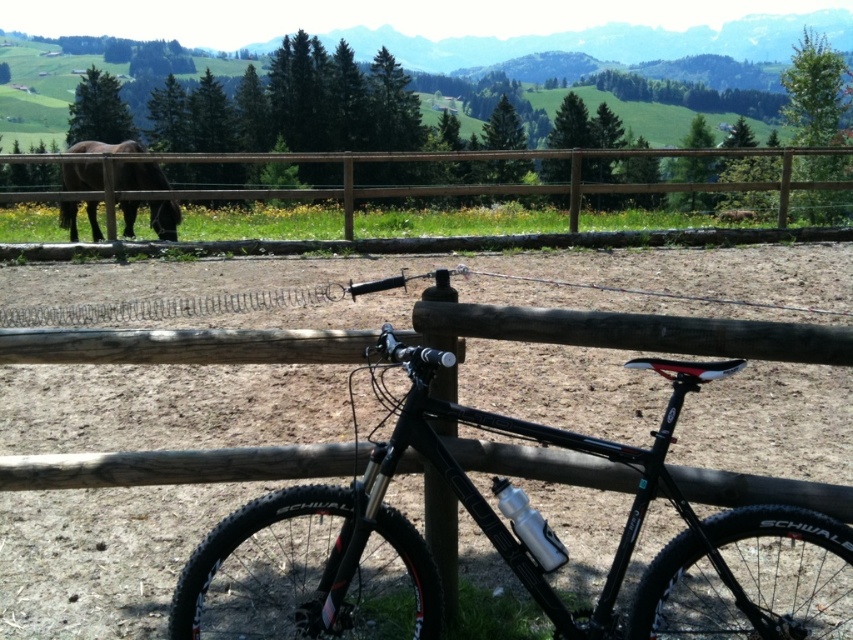
Is point (113, 220) positioned after point (97, 173)?

No, it is in front of (97, 173).

Looking at this image, which is below, brown wooden fence at upper center or brown matte horse at left?

brown matte horse at left is below.

Image resolution: width=853 pixels, height=640 pixels. What are the coordinates of `brown wooden fence at upper center` in the screenshot? It's located at (431, 184).

Can you confirm if black matte mountain bike at center is smaller than brown matte horse at left?

Incorrect, black matte mountain bike at center is not smaller in size than brown matte horse at left.

Which is in front, point (383, 449) or point (160, 202)?

Point (383, 449)

Between point (235, 625) and point (131, 164), which one is positioned in front?

Point (235, 625) is in front.

Locate an element on the screen. The height and width of the screenshot is (640, 853). black matte mountain bike at center is located at coordinates (498, 541).

The width and height of the screenshot is (853, 640). Describe the element at coordinates (498, 541) in the screenshot. I see `black matte mountain bike at center` at that location.

Describe the element at coordinates (498, 541) in the screenshot. I see `black matte mountain bike at center` at that location.

Image resolution: width=853 pixels, height=640 pixels. Identify the location of black matte mountain bike at center. (498, 541).